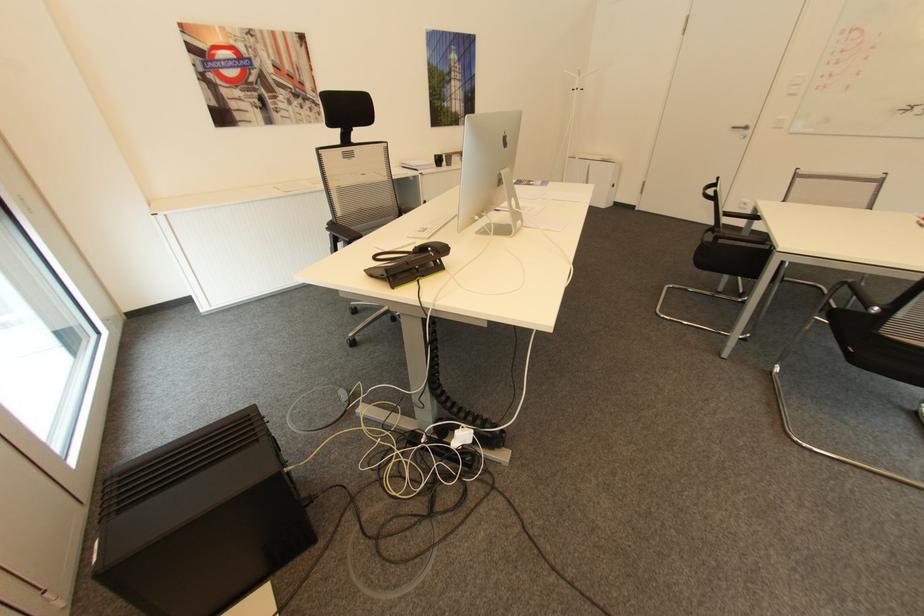
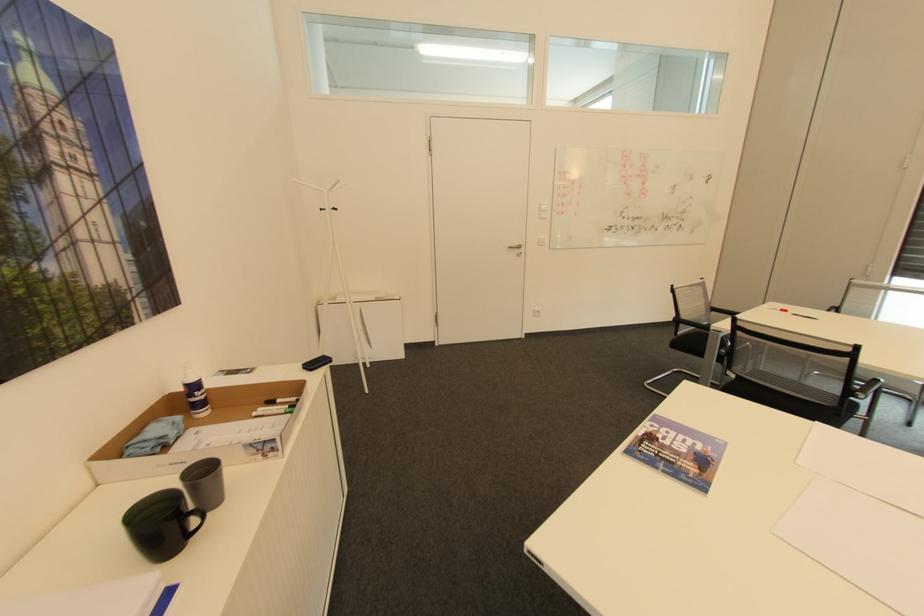
Locate, in the second image, the point that corresponds to point (749, 128) in the first image.

(524, 246)